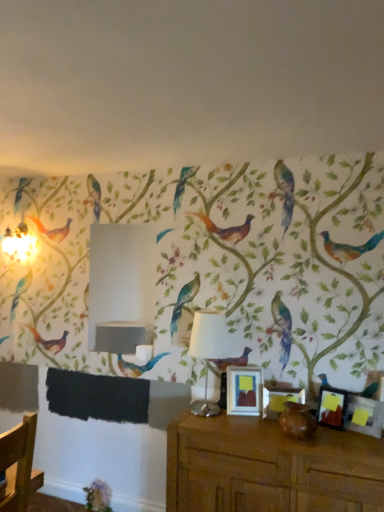
Locate an element on the screen. vacant space to the right of brown matte vase at lower center is located at coordinates (335, 438).